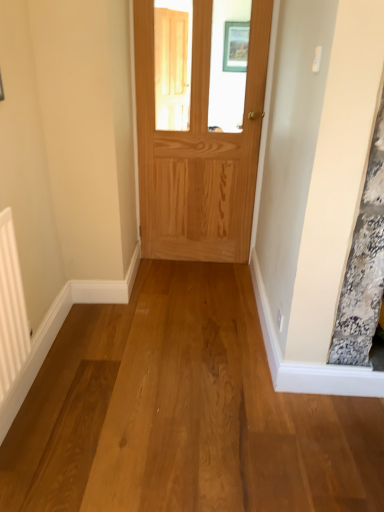
Question: In the image, is white textured radiator at left on the left side or the right side of natural wood door at center?

Choices:
 (A) right
 (B) left

Answer: (B)

Question: From the image's perspective, is white textured radiator at left above or below natural wood door at center?

Choices:
 (A) below
 (B) above

Answer: (A)

Question: Looking at the image, does white textured radiator at left seem bigger or smaller compared to natural wood door at center?

Choices:
 (A) small
 (B) big

Answer: (A)

Question: Does point (185, 245) appear closer or farther from the camera than point (18, 364)?

Choices:
 (A) closer
 (B) farther

Answer: (B)

Question: In terms of size, does natural wood door at center appear bigger or smaller than white textured radiator at left?

Choices:
 (A) big
 (B) small

Answer: (A)

Question: From a real-world perspective, is natural wood door at center physically located above or below white textured radiator at left?

Choices:
 (A) below
 (B) above

Answer: (B)

Question: Is natural wood door at center taller or shorter than white textured radiator at left?

Choices:
 (A) short
 (B) tall

Answer: (B)